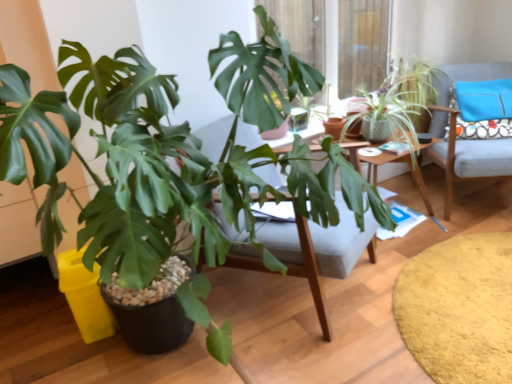
Image resolution: width=512 pixels, height=384 pixels. What are the coordinates of `blue fabric pillow at upper right` in the screenshot? It's located at 484,99.

Where is `wooden desk at center`? This screenshot has height=384, width=512. wooden desk at center is located at coordinates (390, 162).

Identify the location of light gray fabric chair at right. This screenshot has height=384, width=512. (466, 140).

Locate an element on the screen. green textured plant at upper right, the second houseplant from the front is located at coordinates (402, 97).

How much distance is there between soft yellow rug at lower right and wooden desk at center?

soft yellow rug at lower right and wooden desk at center are 65.20 centimeters apart.

Considering the relative sizes of soft yellow rug at lower right and wooden desk at center in the image provided, is soft yellow rug at lower right bigger than wooden desk at center?

Actually, soft yellow rug at lower right might be smaller than wooden desk at center.

From the picture: Which object is wider, soft yellow rug at lower right or wooden desk at center?

soft yellow rug at lower right.

From the image's perspective, relative to wooden desk at center, is soft yellow rug at lower right above or below?

soft yellow rug at lower right is below wooden desk at center.

From a real-world perspective, relative to soft yellow rug at lower right, is green matte plant at center, which is counted as the first houseplant, starting from the front, vertically above or below?

green matte plant at center, which is counted as the first houseplant, starting from the front, is above soft yellow rug at lower right.

Between green matte plant at center, which ranks as the second houseplant in back-to-front order, and soft yellow rug at lower right, which one has smaller width?

green matte plant at center, which ranks as the second houseplant in back-to-front order, is thinner.

Measure the distance between green matte plant at center, positioned as the 2th houseplant in right-to-left order, and soft yellow rug at lower right.

The distance of green matte plant at center, positioned as the 2th houseplant in right-to-left order, from soft yellow rug at lower right is 38.04 inches.

From the image's perspective, which one is positioned higher, green matte plant at center, which is counted as the first houseplant, starting from the front, or soft yellow rug at lower right?

green matte plant at center, which is counted as the first houseplant, starting from the front, is shown above in the image.

Would you say green matte plant at center, which ranks as the second houseplant in back-to-front order, is part of light gray fabric chair at right's contents?

No.

Does point (461, 79) lie in front of point (197, 257)?

No, (461, 79) is further to viewer.

At what (x,y) coordinates should I click in order to perform the action: click on houseplant in front of the light gray fabric chair at right. Please return your answer as a coordinate pair (x, y). Looking at the image, I should click on (168, 154).

Which object is further away from the camera taking this photo, light gray fabric chair at right or green matte plant at center, the first houseplant viewed from the left?

light gray fabric chair at right.

From the picture: Could green textured plant at upper right, which ranks as the first houseplant in back-to-front order, be considered to be inside green matte plant at center, which ranks as the second houseplant in back-to-front order?

No.

Could you tell me if green matte plant at center, which is counted as the first houseplant, starting from the front, is facing green textured plant at upper right, positioned as the 1th houseplant in right-to-left order?

No, green matte plant at center, which is counted as the first houseplant, starting from the front, is not oriented towards green textured plant at upper right, positioned as the 1th houseplant in right-to-left order.

Is point (315, 182) in front of point (419, 108)?

Yes, point (315, 182) is in front of point (419, 108).

Considering the sizes of objects green matte plant at center, which ranks as the second houseplant in back-to-front order, and green textured plant at upper right, placed as the second houseplant when sorted from left to right, in the image provided, who is bigger, green matte plant at center, which ranks as the second houseplant in back-to-front order, or green textured plant at upper right, placed as the second houseplant when sorted from left to right,?

green matte plant at center, which ranks as the second houseplant in back-to-front order, is bigger.

From the image's perspective, who appears lower, soft yellow rug at lower right or green matte plant at center, positioned as the 2th houseplant in right-to-left order?

soft yellow rug at lower right appears lower in the image.

Consider the image. Which of these two, soft yellow rug at lower right or green matte plant at center, which is counted as the first houseplant, starting from the front, stands shorter?

With less height is soft yellow rug at lower right.

Does soft yellow rug at lower right have a smaller size compared to green matte plant at center, the first houseplant viewed from the left?

Yes, soft yellow rug at lower right is smaller than green matte plant at center, the first houseplant viewed from the left.

Is green matte plant at center, the first houseplant viewed from the left, further to camera compared to wooden desk at center?

No, the depth of green matte plant at center, the first houseplant viewed from the left, is less than that of wooden desk at center.

Between green matte plant at center, the first houseplant viewed from the left, and wooden desk at center, which one appears on the left side from the viewer's perspective?

Positioned to the left is green matte plant at center, the first houseplant viewed from the left.

Is green matte plant at center, which ranks as the second houseplant in back-to-front order, facing away from wooden desk at center?

No, green matte plant at center, which ranks as the second houseplant in back-to-front order,'s orientation is not away from wooden desk at center.

From a real-world perspective, is green matte plant at center, the first houseplant viewed from the left, physically above wooden desk at center?

Yes, from a real-world perspective, green matte plant at center, the first houseplant viewed from the left, is over wooden desk at center

Is wooden swivel chair at center completely or partially outside of green textured plant at upper right, which ranks as the first houseplant in back-to-front order?

That's correct, wooden swivel chair at center is outside of green textured plant at upper right, which ranks as the first houseplant in back-to-front order.

Which is in front, point (246, 256) or point (405, 89)?

Point (246, 256)

In the image, is wooden swivel chair at center positioned in front of or behind green textured plant at upper right, positioned as the 1th houseplant in right-to-left order?

Clearly, wooden swivel chair at center is in front of green textured plant at upper right, positioned as the 1th houseplant in right-to-left order.

Find the location of a particular element. This screenshot has height=384, width=512. swivel chair that appears in front of the green textured plant at upper right, the second houseplant from the front is located at coordinates (319, 250).

You are a GUI agent. You are given a task and a screenshot of the screen. Output one action in this format:
    pyautogui.click(x=<x>, y=<y>)
    Task: Click on the desk located behind the soft yellow rug at lower right
    The height and width of the screenshot is (384, 512).
    Given the screenshot: What is the action you would take?
    pyautogui.click(x=390, y=162)

Locate an element on the screen. Image resolution: width=512 pixels, height=384 pixels. houseplant that is the 2nd object above the soft yellow rug at lower right (from a real-world perspective) is located at coordinates point(168,154).

When comparing their distances from wooden desk at center, does green textured plant at upper right, positioned as the 1th houseplant in right-to-left order, or light gray fabric chair at right seem closer?

Based on the image, light gray fabric chair at right appears to be nearer to wooden desk at center.

Based on their spatial positions, is blue fabric pillow at upper right or wooden desk at center further from green matte plant at center, positioned as the 2th houseplant in right-to-left order?

Among the two, blue fabric pillow at upper right is located further to green matte plant at center, positioned as the 2th houseplant in right-to-left order.

When comparing their distances from blue fabric pillow at upper right, does light gray fabric chair at right or wooden swivel chair at center seem closer?

light gray fabric chair at right is positioned closer to the anchor blue fabric pillow at upper right.

Considering their positions, is soft yellow rug at lower right positioned further to green matte plant at center, which ranks as the second houseplant in back-to-front order, than green textured plant at upper right, placed as the second houseplant when sorted from left to right?

Among the two, green textured plant at upper right, placed as the second houseplant when sorted from left to right, is located further to green matte plant at center, which ranks as the second houseplant in back-to-front order.

Looking at this image, which object lies nearer to the anchor point wooden swivel chair at center, soft yellow rug at lower right or light gray fabric chair at right?

Among the two, soft yellow rug at lower right is located nearer to wooden swivel chair at center.

Considering their positions, is wooden swivel chair at center positioned further to soft yellow rug at lower right than light gray fabric chair at right?

Based on the image, light gray fabric chair at right appears to be further to soft yellow rug at lower right.

Looking at the image, which one is located further to blue fabric pillow at upper right, green matte plant at center, which is counted as the first houseplant, starting from the front, or soft yellow rug at lower right?

The object further to blue fabric pillow at upper right is green matte plant at center, which is counted as the first houseplant, starting from the front.

Considering their positions, is green matte plant at center, which ranks as the second houseplant in back-to-front order, positioned further to wooden desk at center than soft yellow rug at lower right?

Based on the image, green matte plant at center, which ranks as the second houseplant in back-to-front order, appears to be further to wooden desk at center.

This screenshot has height=384, width=512. In order to click on mat between green matte plant at center, which is counted as the first houseplant, starting from the front, and wooden desk at center, along the z-axis in this screenshot , I will do `click(459, 309)`.

The width and height of the screenshot is (512, 384). Find the location of `houseplant between wooden desk at center and blue fabric pillow at upper right in the horizontal direction`. houseplant between wooden desk at center and blue fabric pillow at upper right in the horizontal direction is located at coordinates (402, 97).

Where is `mat between green matte plant at center, which ranks as the second houseplant in back-to-front order, and light gray fabric chair at right from left to right`? This screenshot has height=384, width=512. mat between green matte plant at center, which ranks as the second houseplant in back-to-front order, and light gray fabric chair at right from left to right is located at coordinates point(459,309).

Find the location of a particular element. This screenshot has height=384, width=512. chair between green matte plant at center, which is counted as the first houseplant, starting from the front, and green textured plant at upper right, placed as the second houseplant when sorted from left to right, from front to back is located at coordinates (466, 140).